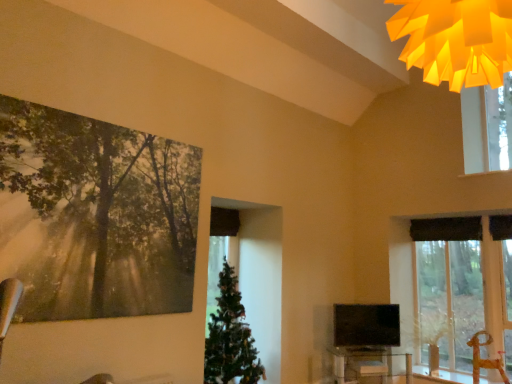
Question: Is black textured curtain at upper center to the right of green matte christmas tree at center from the viewer's perspective?

Choices:
 (A) no
 (B) yes

Answer: (B)

Question: Is black textured curtain at upper center positioned with its back to green matte christmas tree at center?

Choices:
 (A) no
 (B) yes

Answer: (A)

Question: From the image's perspective, is black textured curtain at upper center located beneath green matte christmas tree at center?

Choices:
 (A) no
 (B) yes

Answer: (A)

Question: Is black textured curtain at upper center not close to green matte christmas tree at center?

Choices:
 (A) no
 (B) yes

Answer: (B)

Question: Considering the relative sizes of black textured curtain at upper center and green matte christmas tree at center in the image provided, is black textured curtain at upper center smaller than green matte christmas tree at center?

Choices:
 (A) no
 (B) yes

Answer: (B)

Question: From a real-world perspective, is black textured curtain at upper center physically below green matte christmas tree at center?

Choices:
 (A) no
 (B) yes

Answer: (A)

Question: From the image's perspective, is clear glass table at lower center located above green matte christmas tree at center?

Choices:
 (A) no
 (B) yes

Answer: (A)

Question: Does clear glass table at lower center have a greater height compared to green matte christmas tree at center?

Choices:
 (A) no
 (B) yes

Answer: (A)

Question: From the image's perspective, is clear glass table at lower center below green matte christmas tree at center?

Choices:
 (A) no
 (B) yes

Answer: (B)

Question: Is the position of clear glass table at lower center less distant than that of green matte christmas tree at center?

Choices:
 (A) no
 (B) yes

Answer: (A)

Question: Is clear glass table at lower center oriented towards green matte christmas tree at center?

Choices:
 (A) no
 (B) yes

Answer: (A)

Question: Is clear glass table at lower center facing away from green matte christmas tree at center?

Choices:
 (A) yes
 (B) no

Answer: (B)

Question: Is clear glass table at lower center oriented towards metallic silver swivel chair at lower right?

Choices:
 (A) no
 (B) yes

Answer: (A)